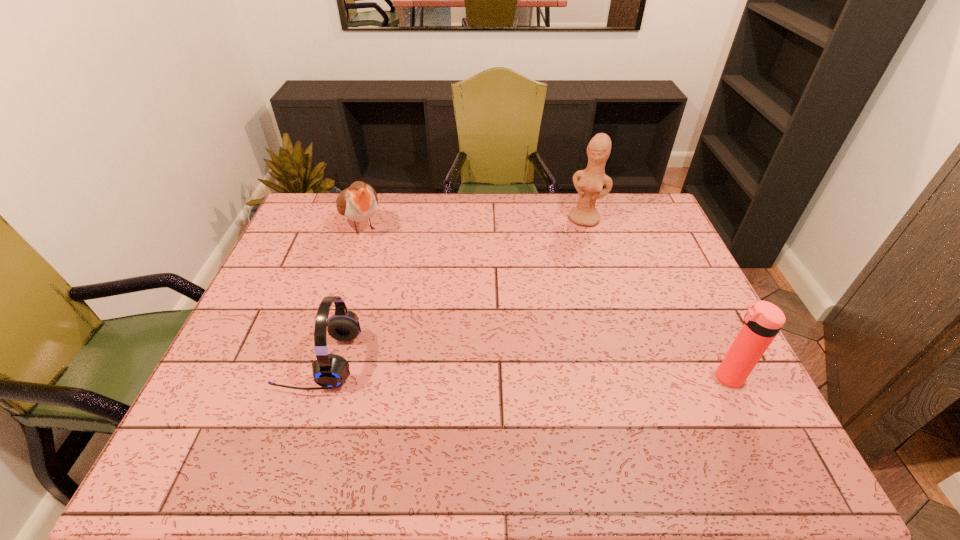
You are a GUI agent. You are given a task and a screenshot of the screen. Output one action in this format:
    pyautogui.click(x=<x>, y=<y>)
    Task: Click on the headset present at the left edge
    This screenshot has height=540, width=960.
    Given the screenshot: What is the action you would take?
    pyautogui.click(x=330, y=371)

The width and height of the screenshot is (960, 540). In order to click on bird located in the left edge section of the desktop in this screenshot , I will do `click(358, 203)`.

Identify the location of object that is at the right edge. This screenshot has height=540, width=960. (763, 320).

You are a GUI agent. You are given a task and a screenshot of the screen. Output one action in this format:
    pyautogui.click(x=<x>, y=<y>)
    Task: Click on the object located at the far left corner
    The image size is (960, 540).
    Given the screenshot: What is the action you would take?
    pyautogui.click(x=358, y=203)

Find the location of a particular element. The image size is (960, 540). object that is at the near left corner is located at coordinates (330, 371).

This screenshot has width=960, height=540. What are the coordinates of `object located in the near right corner section of the desktop` in the screenshot? It's located at (763, 320).

Identify the location of free region at the far edge of the desktop. The width and height of the screenshot is (960, 540). (473, 192).

In the image, there is a desktop. At what (x,y) coordinates should I click in order to perform the action: click on vacant space at the near edge. Please return your answer as a coordinate pair (x, y). This screenshot has width=960, height=540. Looking at the image, I should click on (334, 412).

What are the coordinates of `vacant space at the left edge of the desktop` in the screenshot? It's located at (321, 241).

Locate an element on the screen. The width and height of the screenshot is (960, 540). vacant space at the right edge of the desktop is located at coordinates (668, 254).